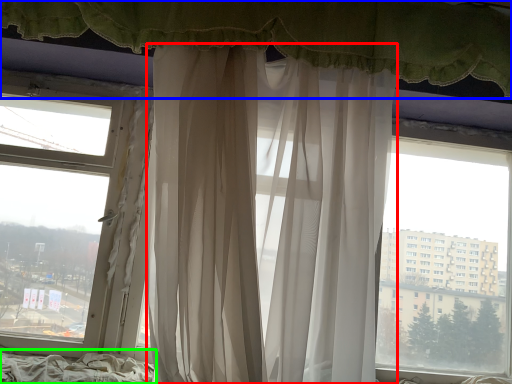
Question: Which is nearer to the curtain (highlighted by a red box)? curtain (highlighted by a blue box) or bed frame (highlighted by a green box).

Choices:
 (A) curtain
 (B) bed frame

Answer: (A)